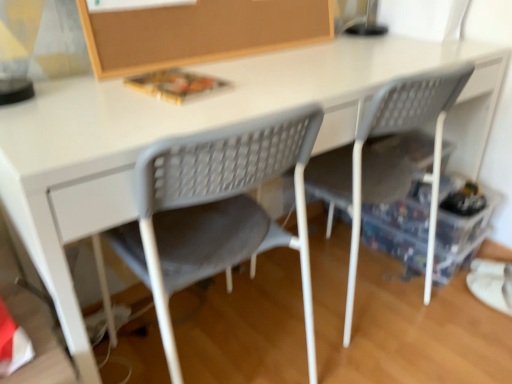
Question: From a real-world perspective, is gray plastic chair at center, which appears as the 1th chair when viewed from the right, above or below gray mesh chair at center, marked as the 1th chair in a left-to-right arrangement?

Choices:
 (A) above
 (B) below

Answer: (A)

Question: Considering the positions of point (330, 185) and point (290, 112), is point (330, 185) closer or farther from the camera than point (290, 112)?

Choices:
 (A) closer
 (B) farther

Answer: (B)

Question: Estimate the real-world distances between objects in this image. Which object is farther from the gray mesh chair at center, marked as the 1th chair in a left-to-right arrangement?

Choices:
 (A) transparent plastic storage box at lower right
 (B) gray plastic chair at center, the second chair positioned from the left
 (C) burlap board at upper center

Answer: (A)

Question: Estimate the real-world distances between objects in this image. Which object is farther from the gray mesh chair at center, the second chair when ordered from right to left?

Choices:
 (A) burlap board at upper center
 (B) transparent plastic storage box at lower right
 (C) gray plastic chair at center, which appears as the 1th chair when viewed from the right

Answer: (B)